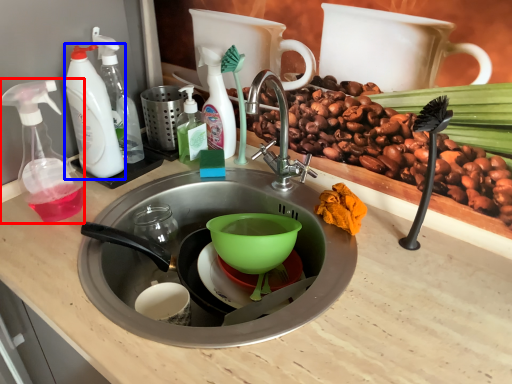
Question: Which point is closer to the camera, soap dispenser (highlighted by a red box) or cleaning product (highlighted by a blue box)?

Choices:
 (A) soap dispenser
 (B) cleaning product

Answer: (A)